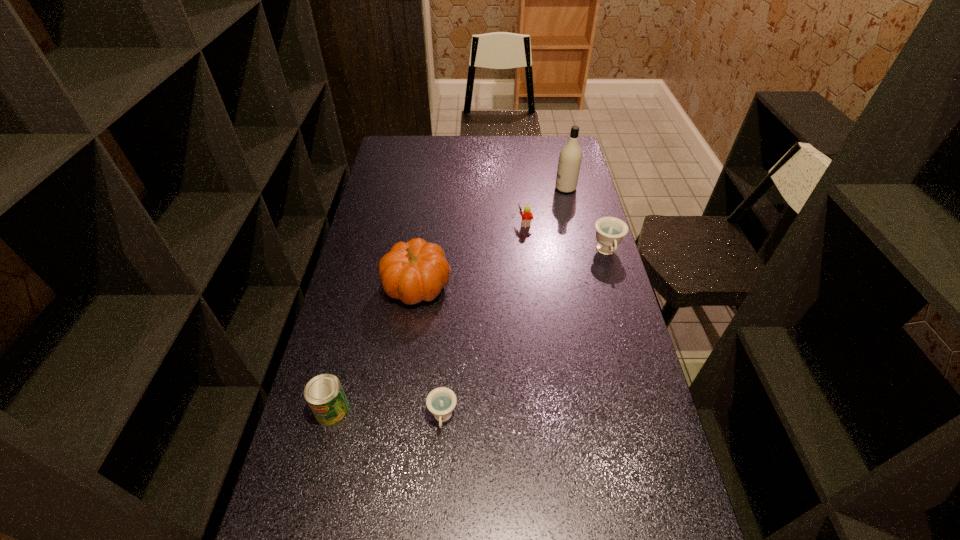
The image size is (960, 540). What are the coordinates of `vacant space situated on the side of the shortest object with the handle` in the screenshot? It's located at (438, 496).

You are a GUI agent. You are given a task and a screenshot of the screen. Output one action in this format:
    pyautogui.click(x=<x>, y=<y>)
    Task: Click on the free spot located 0.270m on the side of the taller teacup with the handle
    This screenshot has width=960, height=540.
    Given the screenshot: What is the action you would take?
    pyautogui.click(x=629, y=329)

Identify the location of free space located 0.230m in front of the fifth nearest object with the accessory visible. This screenshot has width=960, height=540. (458, 222).

Locate an element on the screen. This screenshot has width=960, height=540. vacant space located 0.120m in front of the fifth nearest object with the accessory visible is located at coordinates click(487, 222).

Image resolution: width=960 pixels, height=540 pixels. Find the location of `free space located in front of the fifth nearest object with the accessory visible`. free space located in front of the fifth nearest object with the accessory visible is located at coordinates (487, 222).

Locate an element on the screen. The height and width of the screenshot is (540, 960). free space located 0.350m on the front-facing side of the tallest object is located at coordinates (472, 188).

This screenshot has height=540, width=960. I want to click on free space located 0.260m on the front-facing side of the tallest object, so click(493, 188).

Locate an element on the screen. This screenshot has height=540, width=960. vacant space situated on the front-facing side of the tallest object is located at coordinates (510, 188).

You are a GUI agent. You are given a task and a screenshot of the screen. Output one action in this format:
    pyautogui.click(x=<x>, y=<y>)
    Task: Click on the vacant space located on the right of the leftmost object
    This screenshot has height=540, width=960.
    Given the screenshot: What is the action you would take?
    pyautogui.click(x=437, y=410)

Locate an element on the screen. The width and height of the screenshot is (960, 540). vacant area situated 0.370m on the front of the fifth shortest object is located at coordinates (397, 424).